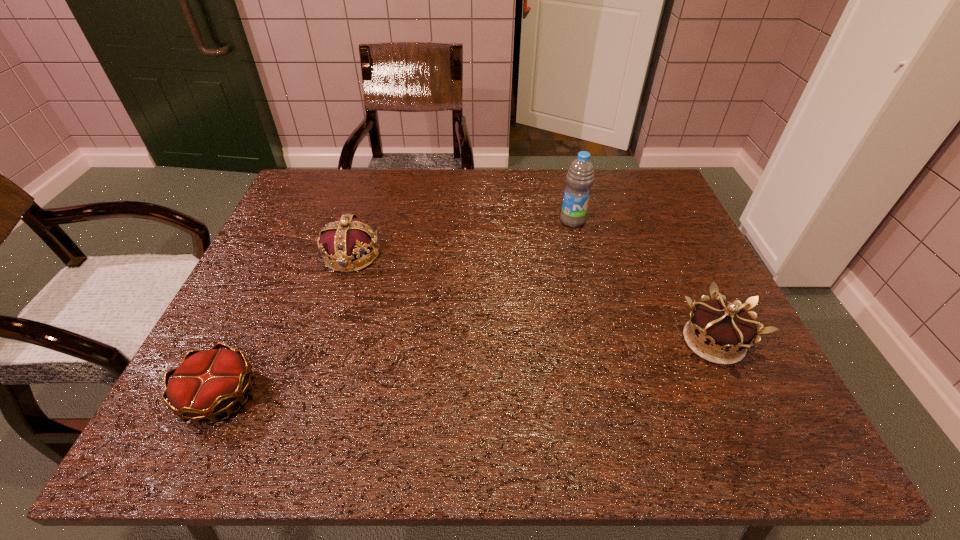
The image size is (960, 540). Find the location of `the tallest object`. the tallest object is located at coordinates (580, 177).

Where is `water bottle`? water bottle is located at coordinates (580, 177).

What are the coordinates of `the second crown from left to right` in the screenshot? It's located at (346, 239).

Image resolution: width=960 pixels, height=540 pixels. What are the coordinates of `the second object from left to right` in the screenshot? It's located at (346, 239).

Locate an element on the screen. the rightmost crown is located at coordinates (727, 330).

Locate an element on the screen. The image size is (960, 540). the shortest crown is located at coordinates (207, 383).

At what (x,y) coordinates should I click in order to perform the action: click on the leftmost crown. Please return your answer as a coordinate pair (x, y). The width and height of the screenshot is (960, 540). Looking at the image, I should click on (207, 383).

Locate an element on the screen. free space located 0.210m on the front of the third object from left to right is located at coordinates (588, 284).

Where is `free spot located 0.050m on the back of the third object from right to left`? This screenshot has height=540, width=960. free spot located 0.050m on the back of the third object from right to left is located at coordinates (361, 224).

Locate an element on the screen. vacant space situated 0.370m on the back of the rightmost crown is located at coordinates (653, 213).